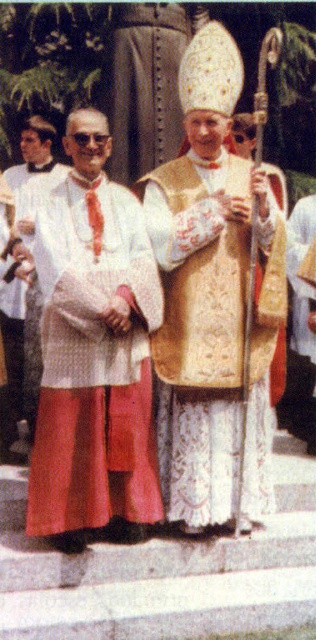
Between point (187, 452) and point (279, 404), which one is positioned behind?

The point (279, 404) is more distant.

Is point (176, 508) more distant than point (290, 410)?

No, it is not.

Find the location of `gold embroidered vestment at center`. gold embroidered vestment at center is located at coordinates (198, 336).

Does matte white robe at center have a lesser width compared to matte white robe at left?

Incorrect, matte white robe at center's width is not less than matte white robe at left's.

Does matte white robe at center have a greater width compared to matte white robe at left?

Yes, matte white robe at center is wider than matte white robe at left.

Locate an element on the screen. The width and height of the screenshot is (316, 640). matte white robe at center is located at coordinates (93, 364).

Between point (172, 518) and point (34, 400), which one is positioned behind?

Positioned behind is point (34, 400).

At what (x,y) coordinates should I click in order to perform the action: click on gold embroidered vestment at center. Please return your answer as a coordinate pair (x, y). This screenshot has height=640, width=316. Looking at the image, I should click on (198, 336).